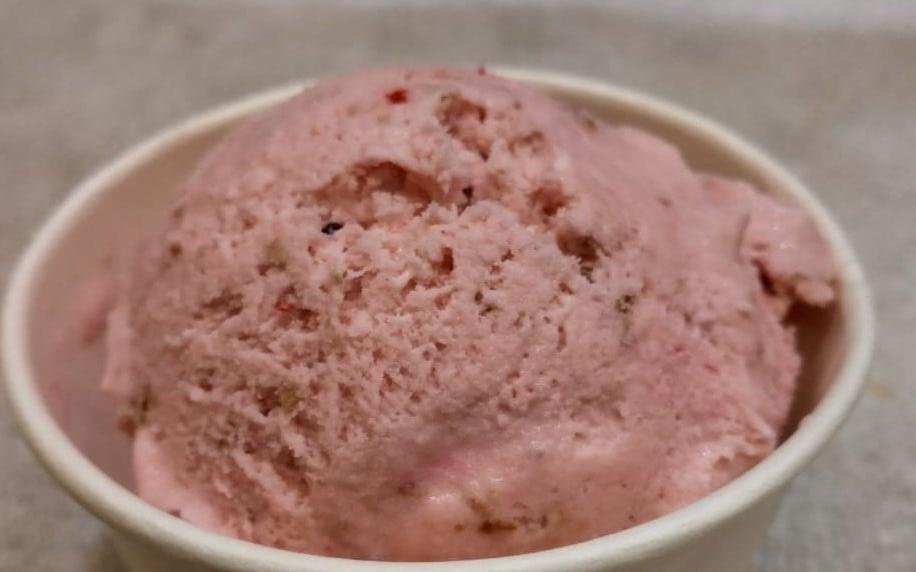
In order to click on bowl rim left side in this screenshot , I will do 11,325.